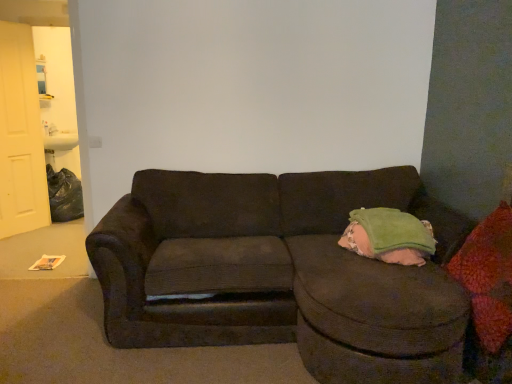
Question: Relative to red textured throw pillow at right, is green corduroy bean bag chair at right in front or behind?

Choices:
 (A) behind
 (B) front

Answer: (A)

Question: From the image's perspective, relative to red textured throw pillow at right, is green corduroy bean bag chair at right above or below?

Choices:
 (A) below
 (B) above

Answer: (B)

Question: Based on their relative distances, which object is nearer to the green corduroy bean bag chair at right?

Choices:
 (A) dark corduroy couch at center
 (B) red textured throw pillow at right
 (C) white matte door at left

Answer: (B)

Question: Which object is the closest to the green corduroy bean bag chair at right?

Choices:
 (A) red textured throw pillow at right
 (B) white matte door at left
 (C) dark corduroy couch at center

Answer: (A)